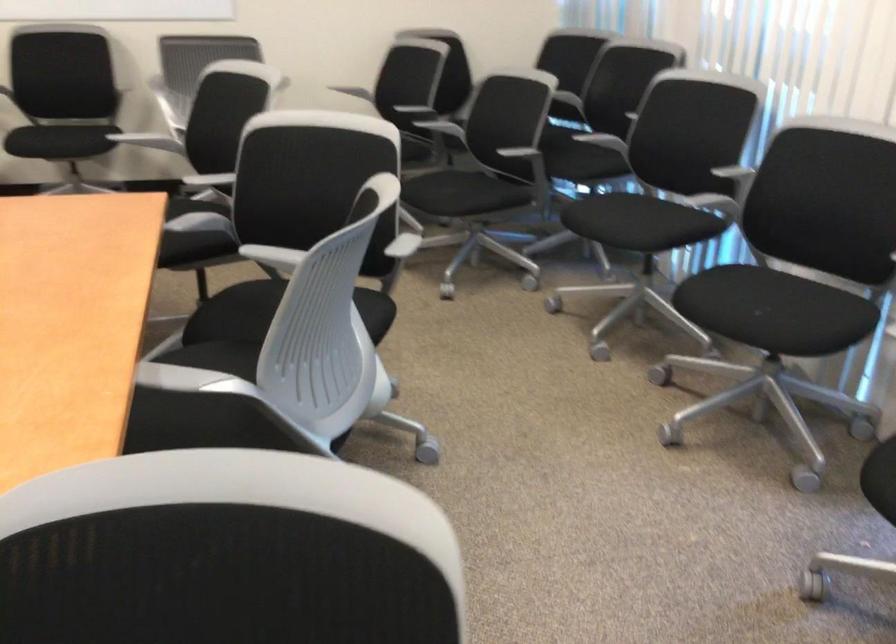
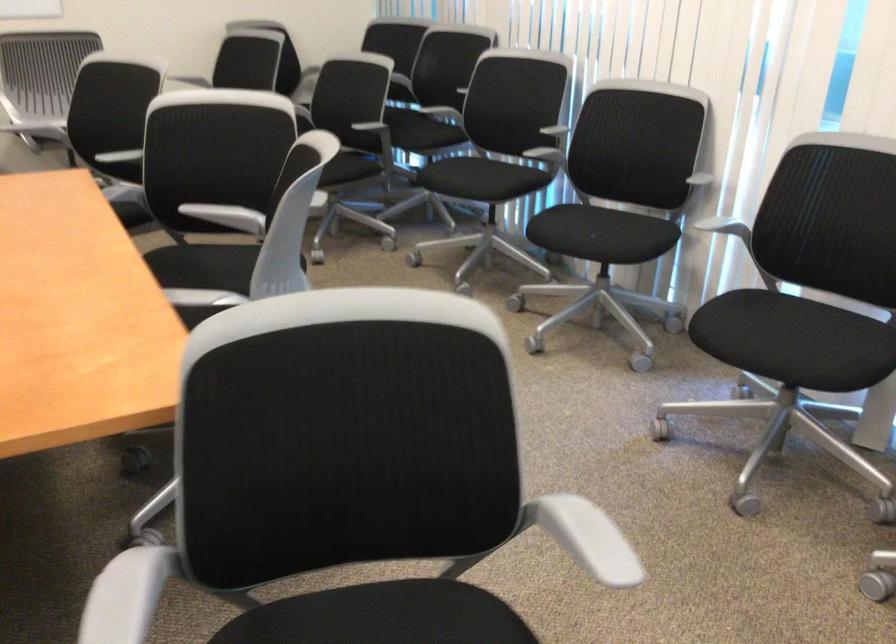
Where in the second image is the point corresponding to [742,307] from the first image?

(582, 232)